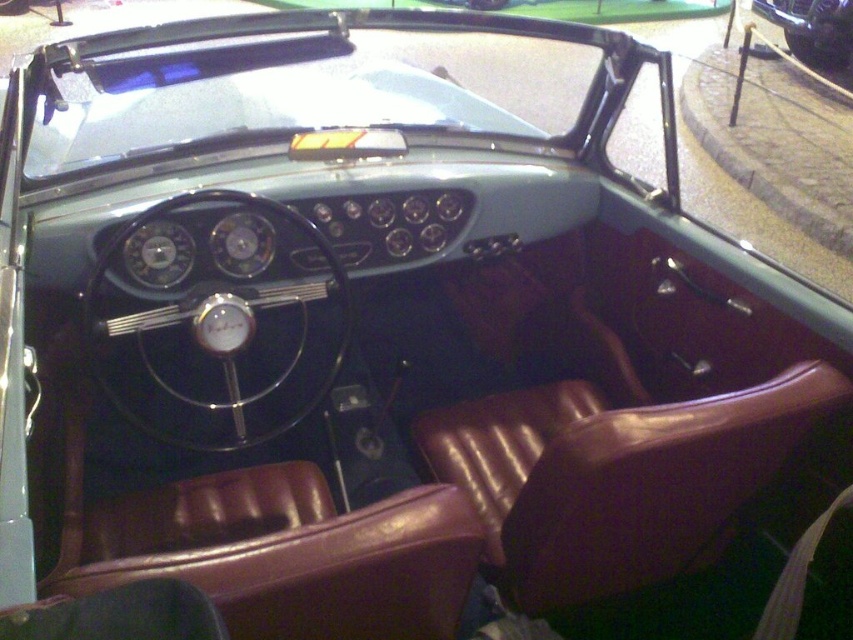
You are a passenger sitting in the vintage convertible car. You notice the black leather steering wheel at center and the shiny black car at upper right. Which object is positioned lower in the car?

The black leather steering wheel at center is positioned below the shiny black car at upper right, so it is lower in the car.

You are sitting in the driver seat of the vintage convertible car. You notice the black leather steering wheel at center and the shiny black car at upper right. Which object is positioned to the left of the other?

The black leather steering wheel at center is positioned to the left of the shiny black car at upper right.